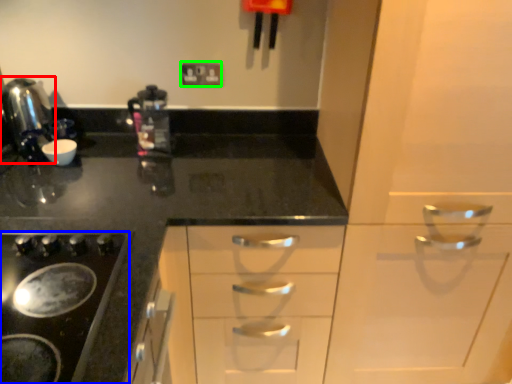
Question: Which object is positioned closest to kitchen appliance (highlighted by a red box)? Select from gas stove (highlighted by a blue box) and electric outlet (highlighted by a green box).

Choices:
 (A) gas stove
 (B) electric outlet

Answer: (B)